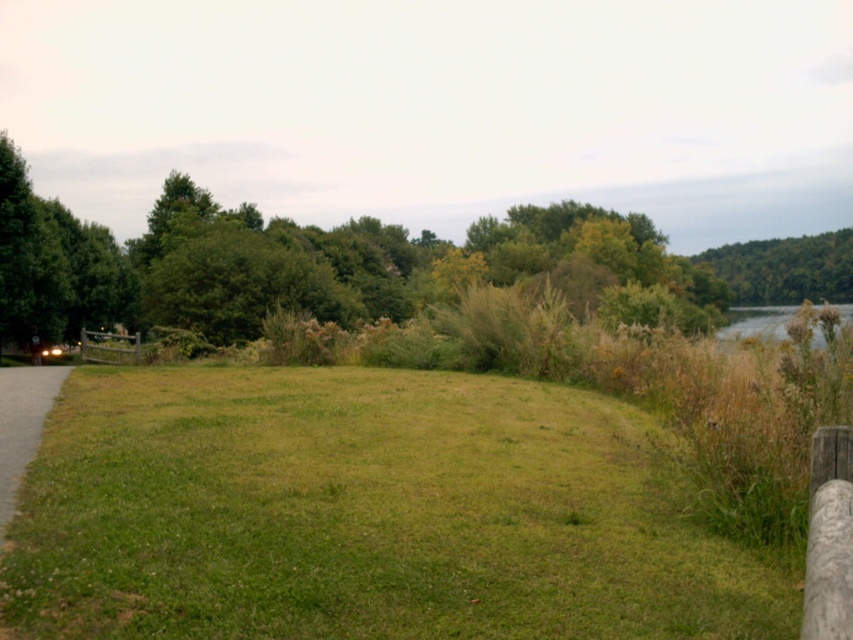
You are standing on the paved path to the left and want to walk towards the green leafy hill at upper right. Which direction should you walk to avoid the green leafy tree at left?

You should walk towards the right side of the green leafy tree at left to reach the green leafy hill at upper right since the tree is positioned over the hill.

You are standing on the green grassy at center and want to walk towards the green leafy hill at upper right. Which direction should you head?

You should head to the right because the green grassy at center is to the left of the green leafy hill at upper right, so moving right will take you towards it.